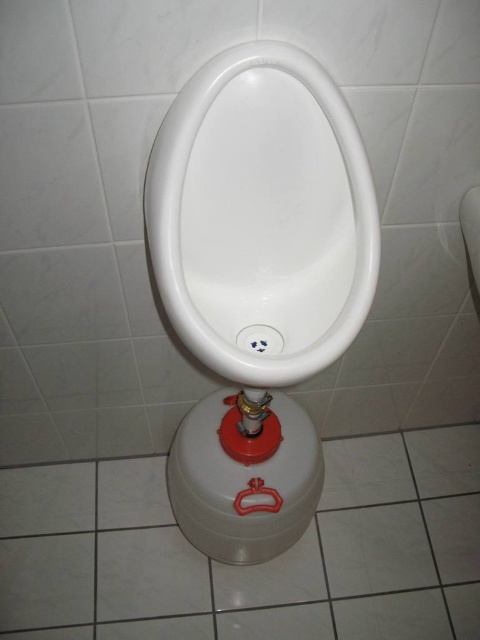
You are standing in a restroom and need to use the facilities. You see a white glossy urinal at center and a white glossy toilet bowl at center. Which one is closer to you?

The white glossy urinal at center is closer to the viewer than the white glossy toilet bowl at center.

You are a plumber trying to install a new white glossy urinal at center in a bathroom that already has a white glossy toilet bowl at center. The bathroom has limited space between the walls. Based on the image, which object has a narrower width, requiring less space for installation?

The white glossy urinal at center has a narrower width than the white glossy toilet bowl at center, so it requires less space for installation.

You are standing in a restroom and need to use the white glossy urinal at center. Based on its position, where should you aim?

The white glossy urinal at center is positioned at point (262, 216), so you should aim towards the center of the urinal.